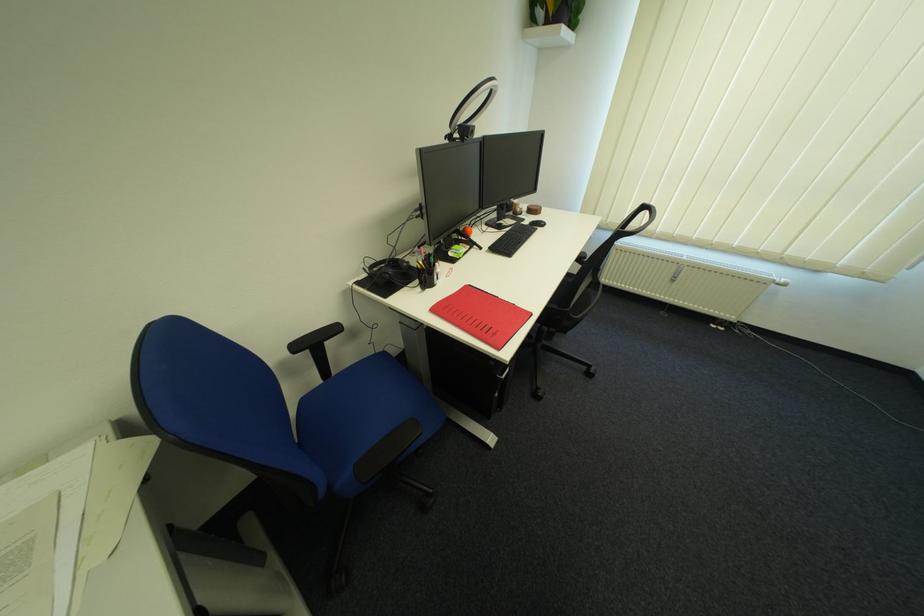
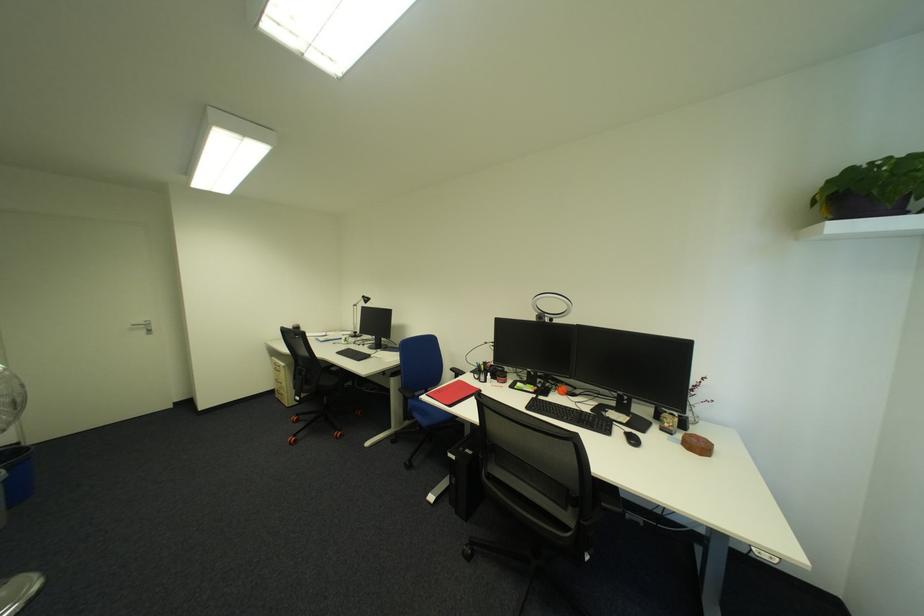
Find the pixel in the second image that matches point 306,349 in the first image.

(462, 370)